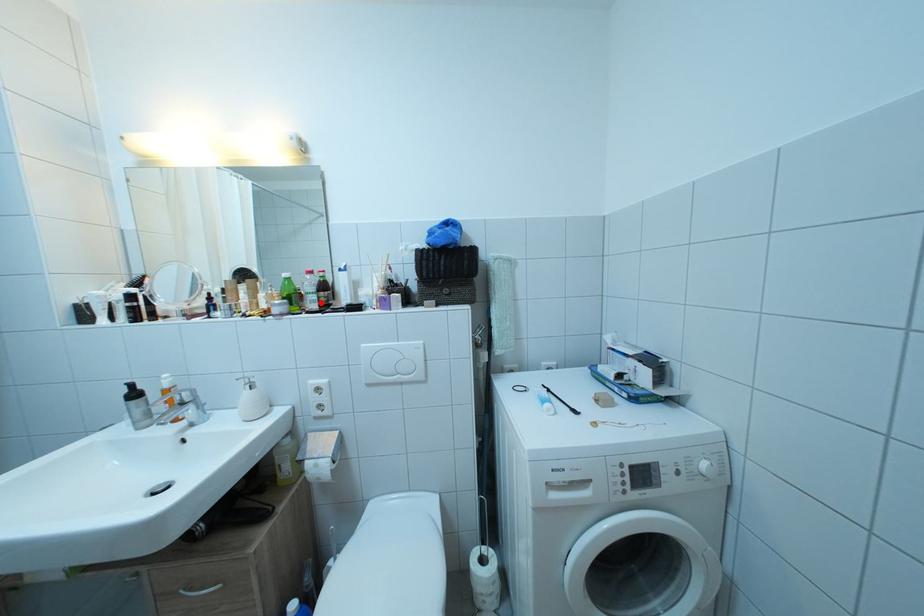
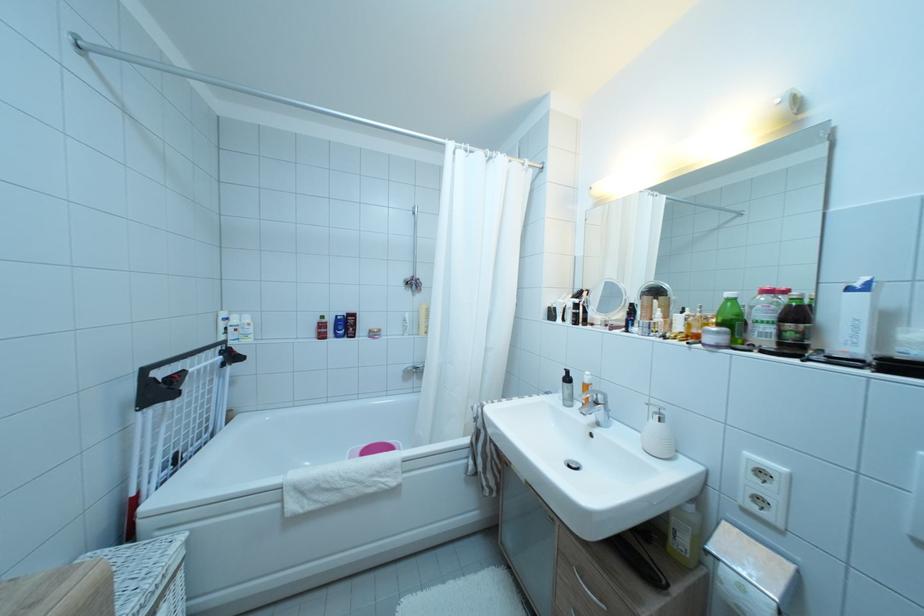
Where in the second image is the point corresponding to the highlighted location from the first image?

(776, 334)